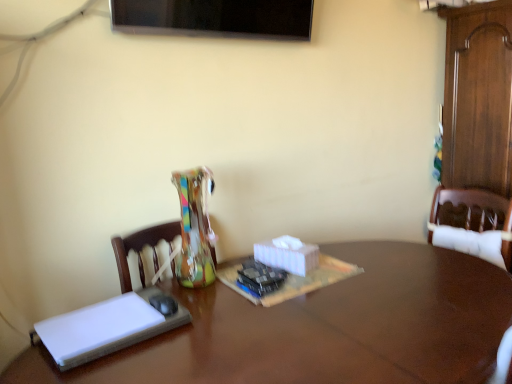
Question: Is white matte book at left to the left or to the right of brown wooden table at center in the image?

Choices:
 (A) right
 (B) left

Answer: (B)

Question: Considering the positions of white matte book at left and brown wooden table at center in the image, is white matte book at left taller or shorter than brown wooden table at center?

Choices:
 (A) short
 (B) tall

Answer: (A)

Question: Would you say white matte book at left is inside or outside brown wooden table at center?

Choices:
 (A) outside
 (B) inside

Answer: (A)

Question: Is brown wooden table at center inside the boundaries of white matte book at left, or outside?

Choices:
 (A) outside
 (B) inside

Answer: (A)

Question: Considering the positions of point (441, 258) and point (106, 314), is point (441, 258) closer or farther from the camera than point (106, 314)?

Choices:
 (A) farther
 (B) closer

Answer: (A)

Question: Considering the positions of brown wooden table at center and white matte book at left in the image, is brown wooden table at center bigger or smaller than white matte book at left?

Choices:
 (A) small
 (B) big

Answer: (B)

Question: From the image's perspective, is brown wooden table at center positioned above or below white matte book at left?

Choices:
 (A) below
 (B) above

Answer: (A)